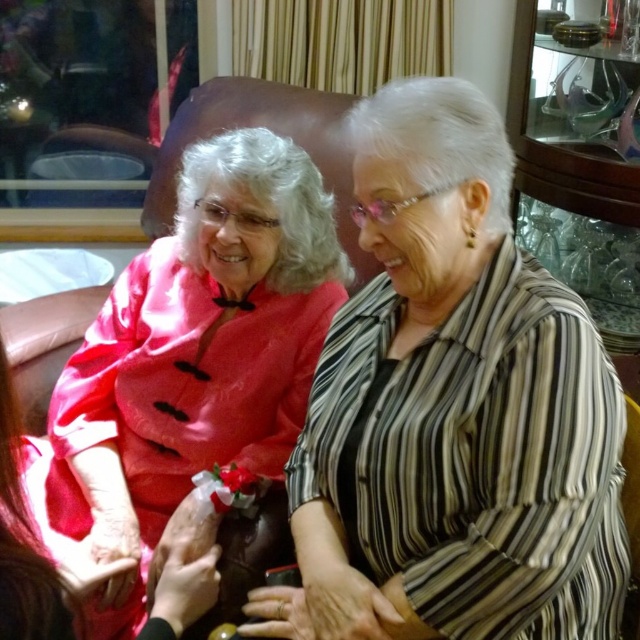
Question: Can you confirm if striped fabric at center is positioned to the left of silky pink dress at center?

Choices:
 (A) no
 (B) yes

Answer: (A)

Question: Can you confirm if striped fabric at center is smaller than silky pink dress at center?

Choices:
 (A) yes
 (B) no

Answer: (A)

Question: Does striped fabric at center appear on the left side of silky pink dress at center?

Choices:
 (A) no
 (B) yes

Answer: (A)